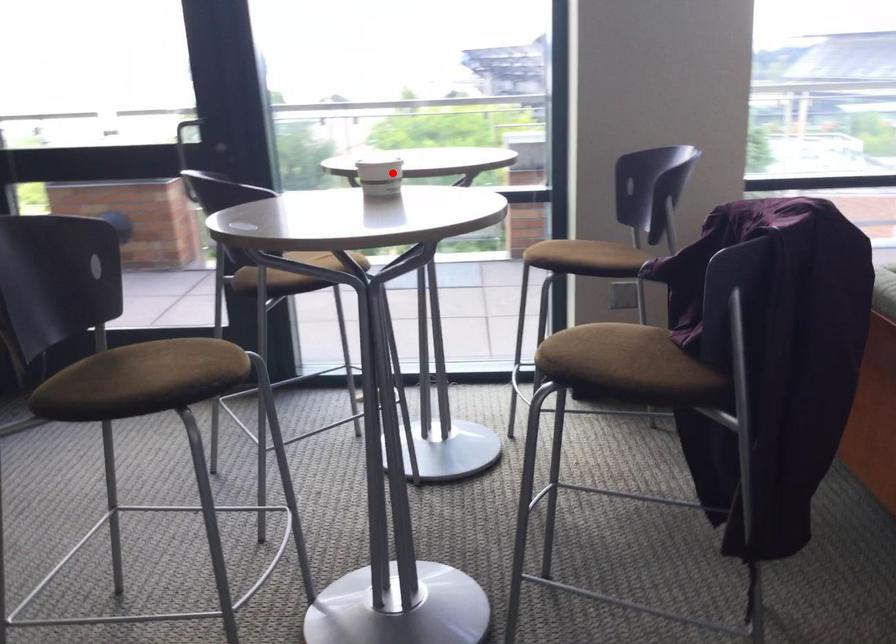
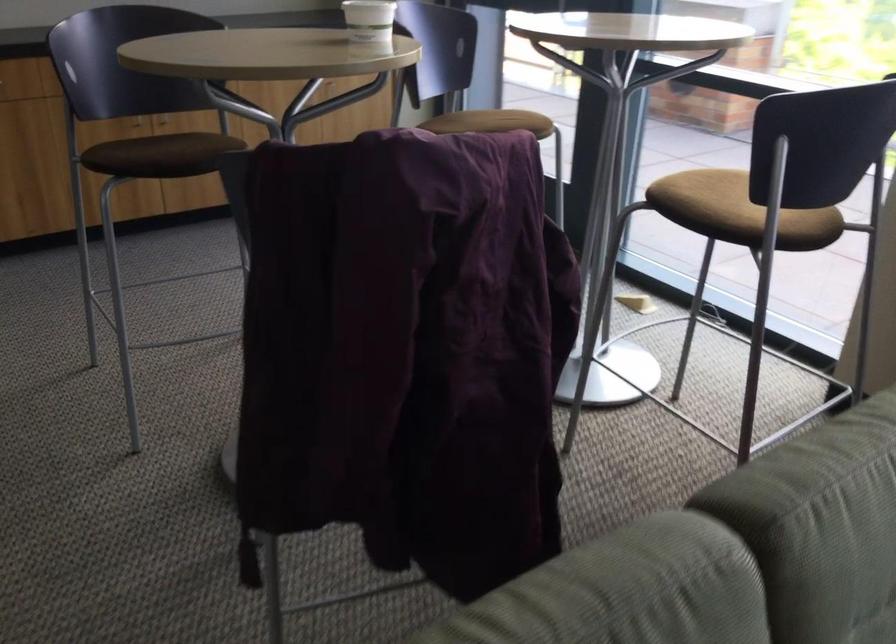
In the second image, find the point that corresponds to the highlighted location in the first image.

(368, 20)